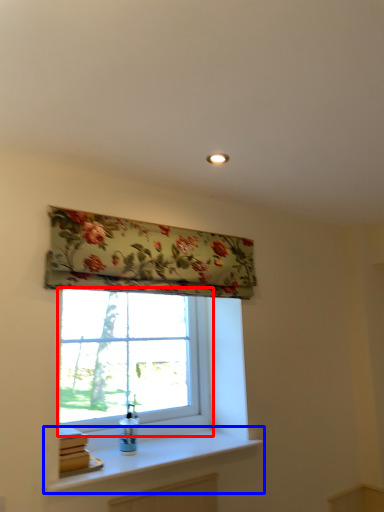
Question: Among these objects, which one is nearest to the camera, window (highlighted by a red box) or window sill (highlighted by a blue box)?

Choices:
 (A) window
 (B) window sill

Answer: (B)